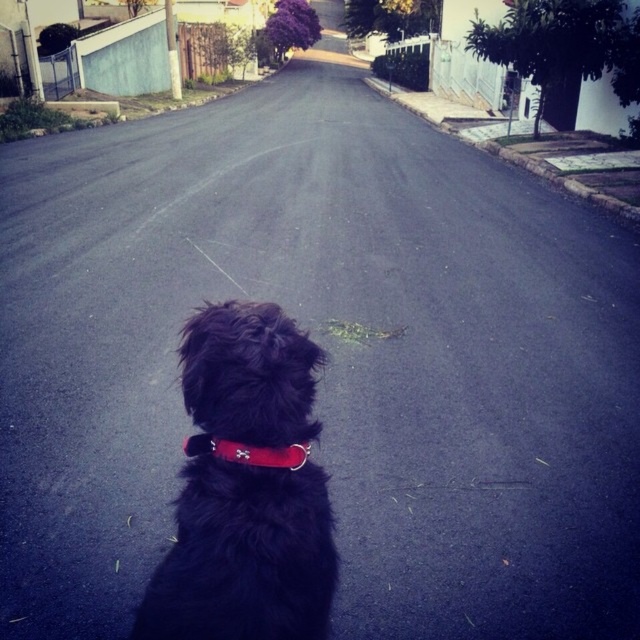
You are standing behind the black fuzzy dog at center and want to throw a ball so it lands directly in front of the dog. Based on the scene description, where should you aim relative to the dog?

Since the black fuzzy dog at center is located at point (x=246, y=486), you should aim to throw the ball in the direction the dog is facing, which is towards the road ahead. The exact coordinates would depend on the direction vector from the dog, but the key is to aim in front of its current position.

Based on the photo, you are a delivery person trying to attach a package to the black fuzzy dog at center. The package is too heavy to hold in your hands, so you need to secure it to the red matte neckband at center. Is the neckband positioned high enough on the dog to safely attach the package?

The black fuzzy dog at center is below the red matte neckband at center, meaning the neckband is positioned high enough on the dog to safely attach the package.

You are a delivery robot navigating a residential street. You need to deliver a package to a house on the right side of the street. There is a black fuzzy dog at center and a red matte neckband at center in your path. Which object should you avoid first to stay on the correct side of the street?

The black fuzzy dog at center is to the left of the red matte neckband at center, so you should avoid the black fuzzy dog at center first to stay on the correct side of the street.